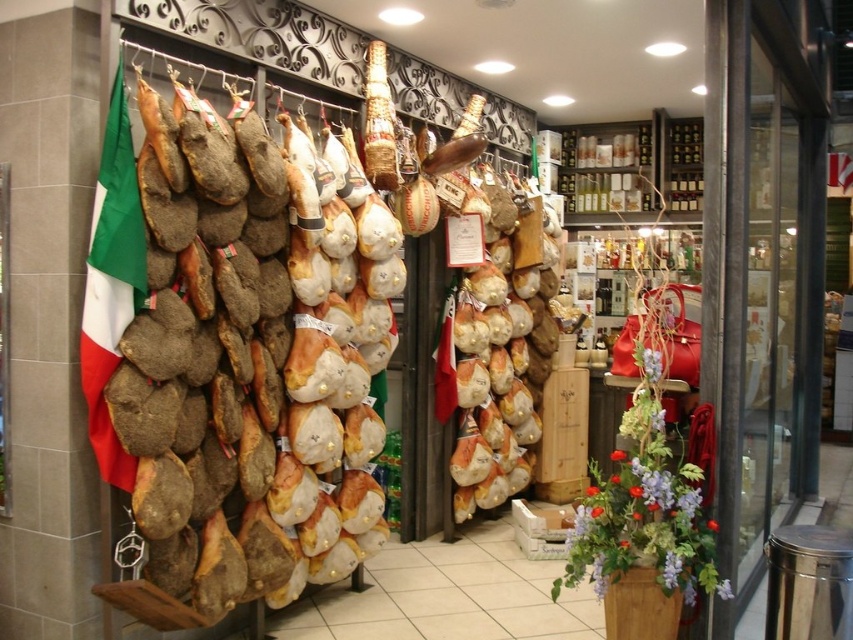
Find the location of a particular element. The height and width of the screenshot is (640, 853). brown textured cured meat at left is located at coordinates (247, 362).